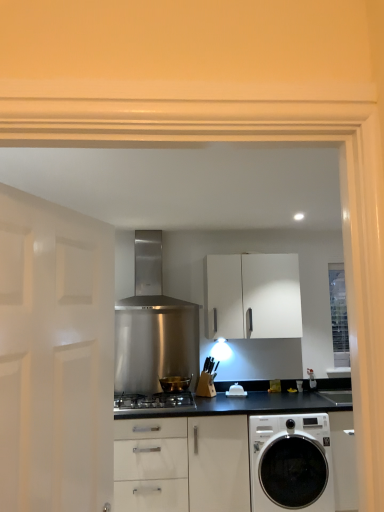
Question: Would you say stainless steel gas stove at center is to the left or to the right of shiny metallic pot at center in the picture?

Choices:
 (A) left
 (B) right

Answer: (A)

Question: From a real-world perspective, relative to shiny metallic pot at center, is stainless steel gas stove at center vertically above or below?

Choices:
 (A) below
 (B) above

Answer: (A)

Question: Estimate the real-world distances between objects in this image. Which object is farther from the white glossy washing machine at lower right?

Choices:
 (A) stainless steel range hood at center
 (B) white matte cabinet at center
 (C) stainless steel gas stove at center
 (D) clear glass window at right
 (E) white matte door at left

Answer: (E)

Question: Estimate the real-world distances between objects in this image. Which object is closer to the shiny metallic pot at center?

Choices:
 (A) stainless steel gas stove at center
 (B) stainless steel range hood at center
 (C) white matte cabinet at center
 (D) white matte door at left
 (E) white glossy washing machine at lower right

Answer: (A)